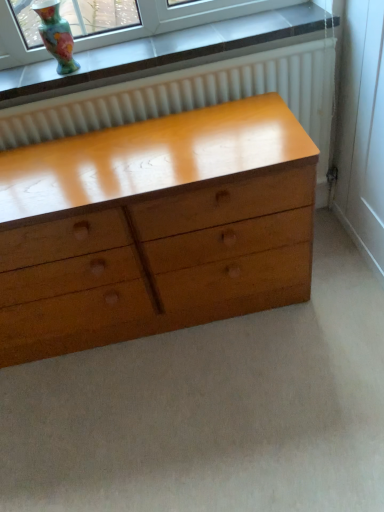
Where is `vacant space in front of glossy wood chest of drawers at center`? Image resolution: width=384 pixels, height=512 pixels. vacant space in front of glossy wood chest of drawers at center is located at coordinates (162, 413).